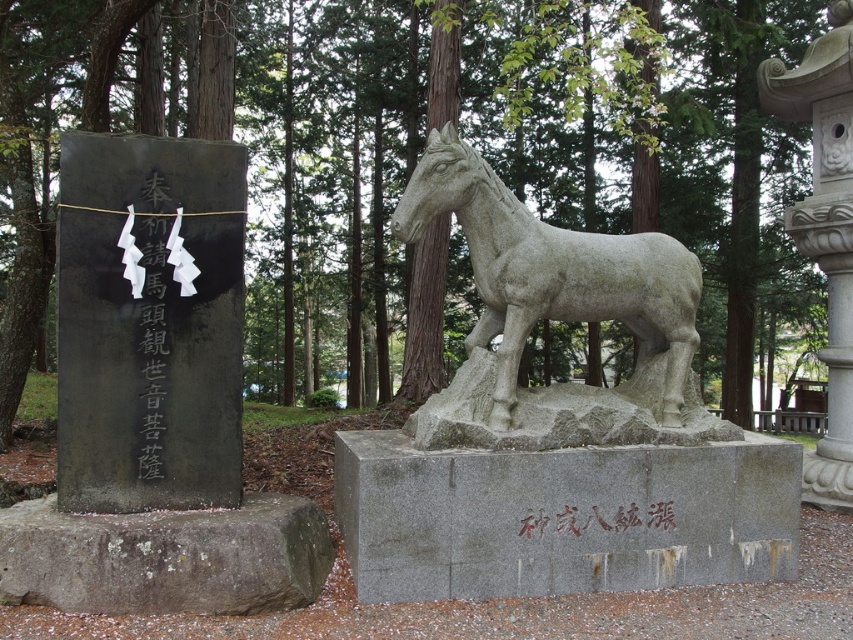
Question: Which object appears farthest from the camera in this image?

Choices:
 (A) black stone monument at left
 (B) gray stone gravestone at center
 (C) gray stone horse at center
 (D) white stone lantern at upper right

Answer: (D)

Question: Does gray stone gravestone at lower left have a greater width compared to black stone inscription at left?

Choices:
 (A) yes
 (B) no

Answer: (A)

Question: Which object is positioned closest to the black stone writing at center?

Choices:
 (A) black stone monument at left
 (B) gray stone horse at center
 (C) gray stone gravestone at center
 (D) black stone inscription at left

Answer: (C)

Question: Does gray stone gravestone at center have a lesser width compared to black stone monument at left?

Choices:
 (A) yes
 (B) no

Answer: (B)

Question: Which point is farther to the camera?

Choices:
 (A) black stone inscription at left
 (B) gray stone horse at center

Answer: (B)

Question: Is black stone monument at left positioned at the back of black stone writing at center?

Choices:
 (A) yes
 (B) no

Answer: (B)